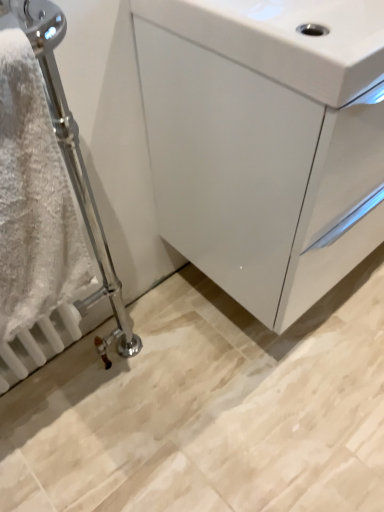
The width and height of the screenshot is (384, 512). Describe the element at coordinates (266, 141) in the screenshot. I see `white glossy cabinet at center` at that location.

Measure the distance between point (338, 69) and camera.

Point (338, 69) and camera are 20.79 inches apart.

Identify the location of white glossy sink at upper right. (286, 39).

Is white glossy sink at upper right at the right side of white fluffy towel at left?

Yes, white glossy sink at upper right is to the right of white fluffy towel at left.

Is white glossy sink at upper right oriented towards white fluffy towel at left?

No, white glossy sink at upper right is not oriented towards white fluffy towel at left.

Is white glossy cabinet at center not close to white fluffy towel at left?

No, white glossy cabinet at center is in close proximity to white fluffy towel at left.

Is white glossy cabinet at center aimed at white fluffy towel at left?

No, white glossy cabinet at center is not turned towards white fluffy towel at left.

Which is behind, point (315, 73) or point (24, 44)?

The point (315, 73) is farther from the camera.

How different are the orientations of white glossy cabinet at center and white fluffy towel at left in degrees?

The angular difference between white glossy cabinet at center and white fluffy towel at left is 0.129 degrees.

Who is smaller, white fluffy towel at left or white glossy sink at upper right?

A: With smaller size is white fluffy towel at left.

Which object is positioned more to the left, white fluffy towel at left or white glossy sink at upper right?

Positioned to the left is white fluffy towel at left.

Can you see white fluffy towel at left touching white glossy sink at upper right?

There is a gap between white fluffy towel at left and white glossy sink at upper right.

Does point (165, 36) appear closer or farther from the camera than point (130, 2)?

Point (165, 36) is positioned closer to the camera compared to point (130, 2).

Between white glossy cabinet at center and white glossy sink at upper right, which one has larger size?

white glossy cabinet at center.

Considering the relative sizes of white glossy cabinet at center and white glossy sink at upper right in the image provided, is white glossy cabinet at center thinner than white glossy sink at upper right?

Incorrect, the width of white glossy cabinet at center is not less than that of white glossy sink at upper right.

From a real-world perspective, relative to white glossy cabinet at center, is white fluffy towel at left vertically above or below?

From a real-world perspective, white fluffy towel at left is physically above white glossy cabinet at center.

Is white fluffy towel at left behind white glossy cabinet at center?

No, it is in front of white glossy cabinet at center.

You are a GUI agent. You are given a task and a screenshot of the screen. Output one action in this format:
    pyautogui.click(x=<x>, y=<y>)
    Task: Click on the bath towel positioned vertically above the white glossy cabinet at center (from a real-world perspective)
    The image size is (384, 512).
    Given the screenshot: What is the action you would take?
    pyautogui.click(x=33, y=198)

Would you say white fluffy towel at left is inside or outside white glossy cabinet at center?

white fluffy towel at left is outside white glossy cabinet at center.

Does white glossy sink at upper right have a lesser height compared to white glossy cabinet at center?

Indeed, white glossy sink at upper right has a lesser height compared to white glossy cabinet at center.

From the image's perspective, is white glossy sink at upper right on top of white glossy cabinet at center?

Indeed, from the image's perspective, white glossy sink at upper right is shown above white glossy cabinet at center.

From a real-world perspective, which object rests below the other?

In real-world perspective, white glossy cabinet at center is lower.

The image size is (384, 512). In order to click on bath towel located below the white glossy sink at upper right (from the image's perspective) in this screenshot , I will do pyautogui.click(x=33, y=198).

This screenshot has height=512, width=384. What are the coordinates of `bathroom cabinet that is above the white fluffy towel at left (from the image's perspective)` in the screenshot? It's located at (266, 141).

When comparing their distances from white glossy sink at upper right, does white glossy cabinet at center or white fluffy towel at left seem closer?

white glossy cabinet at center is closer to white glossy sink at upper right.

From the picture: Based on their spatial positions, is white glossy sink at upper right or white glossy cabinet at center closer to white fluffy towel at left?

white glossy cabinet at center lies closer to white fluffy towel at left than the other object.

Which object lies further to the anchor point white glossy sink at upper right, white fluffy towel at left or white glossy cabinet at center?

The object further to white glossy sink at upper right is white fluffy towel at left.

Estimate the real-world distances between objects in this image. Which object is closer to white fluffy towel at left, white glossy cabinet at center or white glossy sink at upper right?

Among the two, white glossy cabinet at center is located nearer to white fluffy towel at left.

Based on the photo, from the image, which object appears to be farther from white glossy cabinet at center, white fluffy towel at left or white glossy sink at upper right?

white fluffy towel at left.

From the picture: From the image, which object appears to be farther from white glossy cabinet at center, white glossy sink at upper right or white fluffy towel at left?

white fluffy towel at left is positioned further to the anchor white glossy cabinet at center.

Where is `sink between white fluffy towel at left and white glossy cabinet at center from left to right`? The image size is (384, 512). sink between white fluffy towel at left and white glossy cabinet at center from left to right is located at coordinates (286, 39).